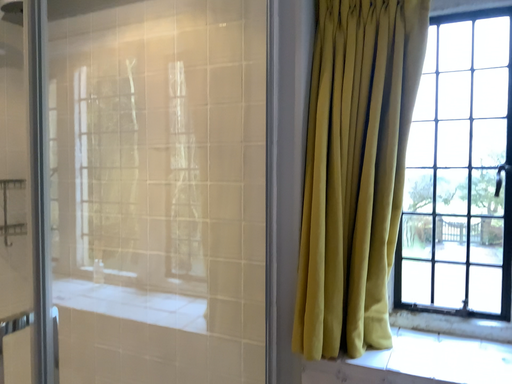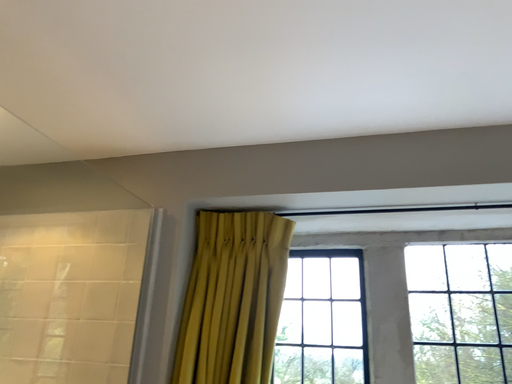
Question: How did the camera likely rotate when shooting the video?

Choices:
 (A) rotated downward
 (B) rotated upward

Answer: (B)